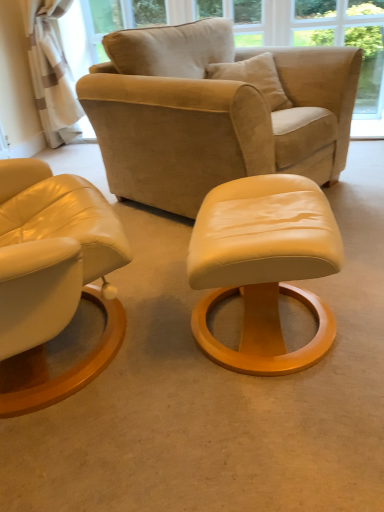
Question: Does matte cream leather ottoman at center have a greater height compared to suede beige armchair at upper center?

Choices:
 (A) no
 (B) yes

Answer: (A)

Question: Can you see matte cream leather ottoman at center touching suede beige armchair at upper center?

Choices:
 (A) yes
 (B) no

Answer: (B)

Question: Are matte cream leather ottoman at center and suede beige armchair at upper center far apart?

Choices:
 (A) yes
 (B) no

Answer: (B)

Question: Is matte cream leather ottoman at center looking in the opposite direction of suede beige armchair at upper center?

Choices:
 (A) no
 (B) yes

Answer: (A)

Question: Would you say matte cream leather ottoman at center contains suede beige armchair at upper center?

Choices:
 (A) no
 (B) yes

Answer: (A)

Question: Considering the relative sizes of matte cream leather ottoman at center and suede beige armchair at upper center in the image provided, is matte cream leather ottoman at center thinner than suede beige armchair at upper center?

Choices:
 (A) yes
 (B) no

Answer: (A)

Question: Is the surface of suede beige armchair at upper center in direct contact with matte cream leather ottoman at center?

Choices:
 (A) no
 (B) yes

Answer: (A)

Question: From a real-world perspective, is suede beige armchair at upper center physically below matte cream leather ottoman at center?

Choices:
 (A) no
 (B) yes

Answer: (A)

Question: From the image's perspective, is suede beige armchair at upper center beneath matte cream leather ottoman at center?

Choices:
 (A) yes
 (B) no

Answer: (B)

Question: Are suede beige armchair at upper center and matte cream leather ottoman at center far apart?

Choices:
 (A) yes
 (B) no

Answer: (B)

Question: Is suede beige armchair at upper center in front of matte cream leather ottoman at center?

Choices:
 (A) no
 (B) yes

Answer: (A)

Question: Is suede beige armchair at upper center behind matte cream leather ottoman at center?

Choices:
 (A) no
 (B) yes

Answer: (B)

Question: From a real-world perspective, is suede beige armchair at upper center above or below matte cream leather ottoman at center?

Choices:
 (A) above
 (B) below

Answer: (A)